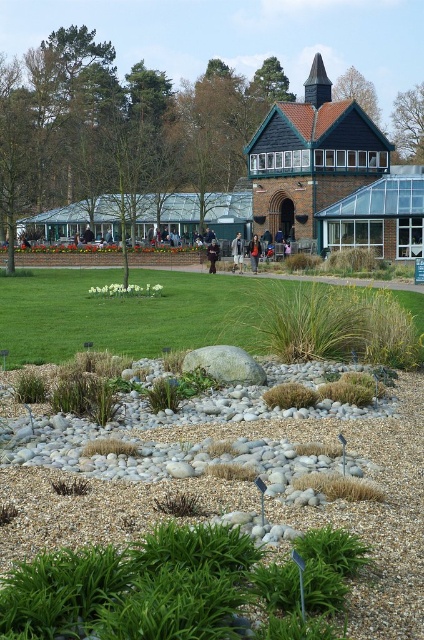
You are standing at the gravel bed in the foreground of the garden. You want to walk to the green grass at center. Is the point at coordinates (133,314) on the path you need to take?

Yes, the point at coordinates (133,314) is on the green grass at center, which is your destination. However, the gravel bed is in the foreground, so you would need to traverse from the gravel bed through the lawn to reach the green grass at center where the point is located.

You are a gardener who wants to plant a new flower bed between the green grass at center and the brown leather jacket at center. Which object should you place the flower bed closer to in order to ensure the flowers won

The green grass at center has a greater height compared to the brown leather jacket at center. Therefore, the flower bed should be placed closer to the brown leather jacket at center to avoid overshadowing the flowers by the taller grass.